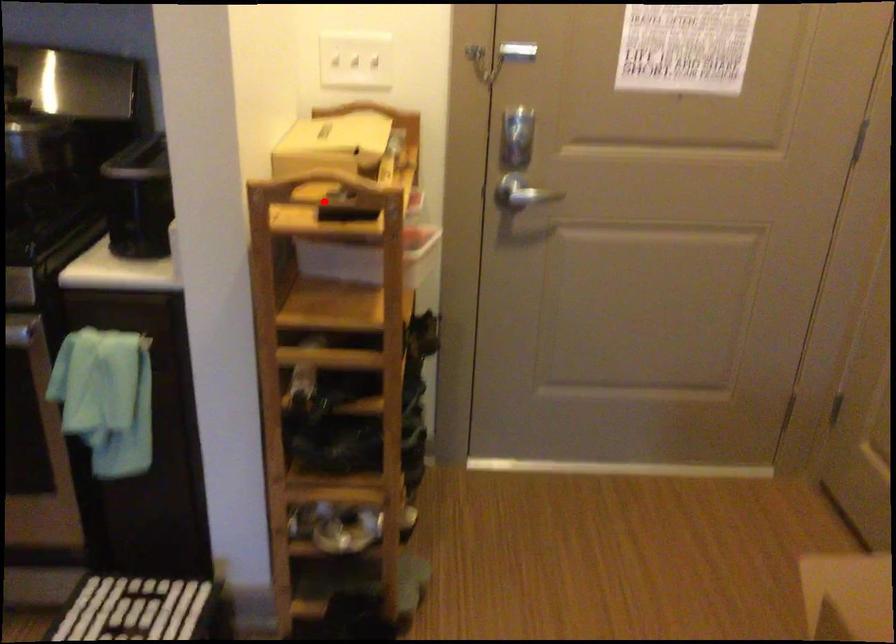
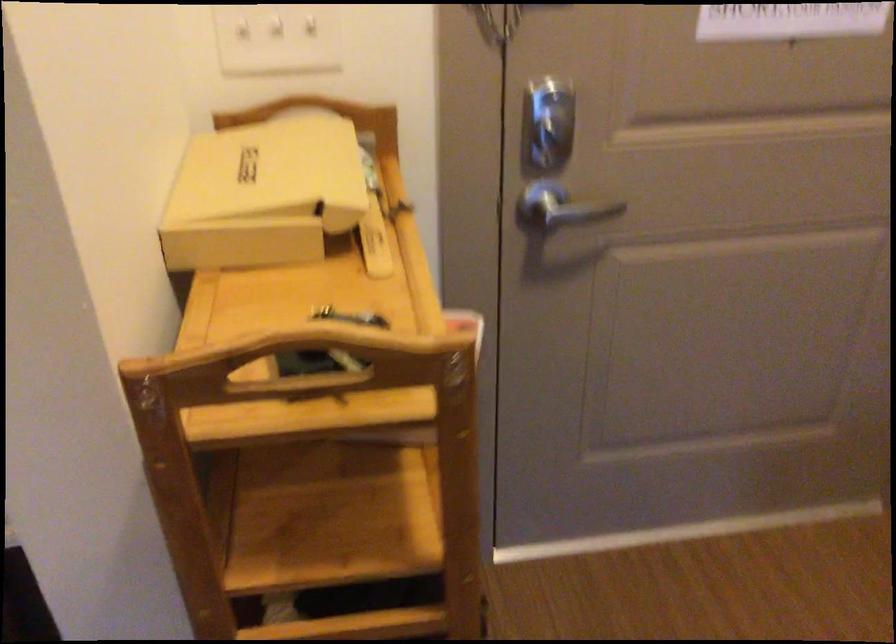
Where in the second image is the point corresponding to the highlighted location from the first image?

(300, 364)